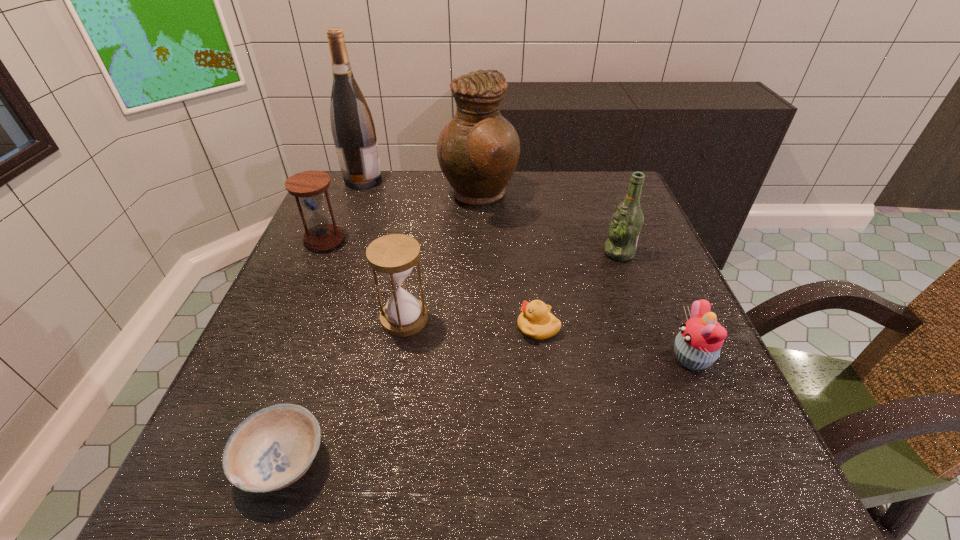
Where is `vacant space situated at the spout of the pitcher`? This screenshot has width=960, height=540. vacant space situated at the spout of the pitcher is located at coordinates (577, 197).

This screenshot has width=960, height=540. In order to click on vacant region located 0.400m on the surface of the beer bottle in this screenshot , I will do `click(429, 253)`.

The image size is (960, 540). What are the coordinates of `vacant space located on the surface of the beer bottle` in the screenshot? It's located at (560, 253).

Identify the location of free location located on the surface of the beer bottle. This screenshot has width=960, height=540. pos(503,253).

Where is `vacant space located on the right of the right hourglass`? The image size is (960, 540). vacant space located on the right of the right hourglass is located at coordinates (484, 319).

Identify the location of free space located on the right of the farther hourglass. (441, 239).

You are a GUI agent. You are given a task and a screenshot of the screen. Output one action in this format:
    pyautogui.click(x=<x>, y=<y>)
    Task: Click on the free space located 0.300m on the face of the third shortest object
    The height and width of the screenshot is (540, 960).
    Given the screenshot: What is the action you would take?
    pyautogui.click(x=503, y=358)

What are the coordinates of `free space located on the face of the third shortest object` in the screenshot? It's located at (592, 358).

I want to click on free spot located 0.290m on the face of the third shortest object, so click(x=509, y=358).

This screenshot has height=540, width=960. I want to click on vacant position located 0.240m on the front-facing side of the duckling, so click(x=392, y=327).